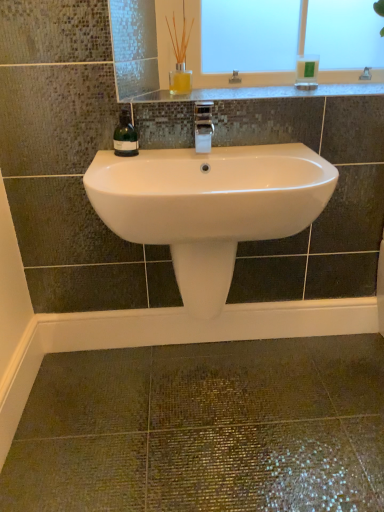
I want to click on free space in front of green glass bottle at left, so click(x=110, y=163).